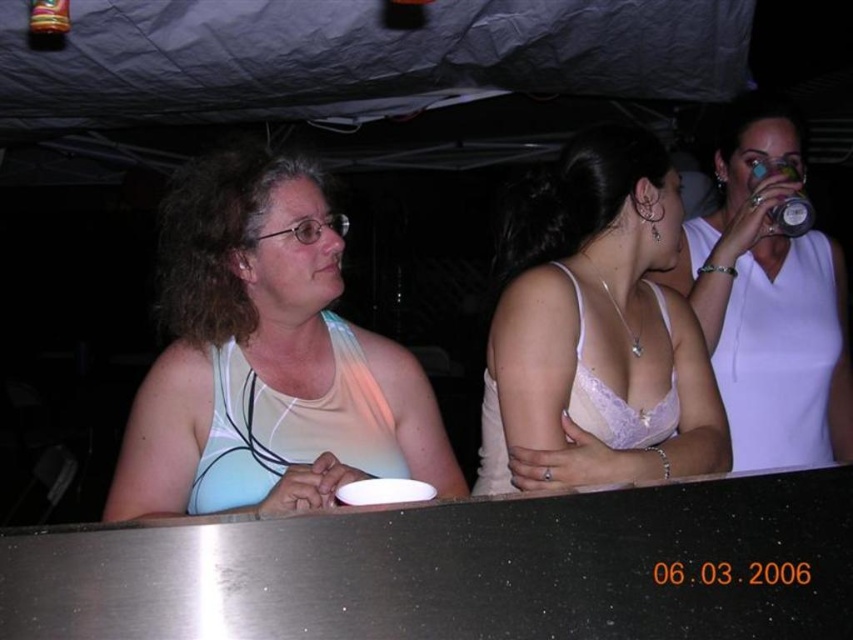
Question: Which object appears farthest from the camera in this image?

Choices:
 (A) white matte tank top at left
 (B) white lace bra at center
 (C) lacy white bikini top at center

Answer: (C)

Question: Can you confirm if white matte bikini top at left is positioned above lacy white bikini top at center?

Choices:
 (A) yes
 (B) no

Answer: (B)

Question: Which of the following is the closest to the observer?

Choices:
 (A) white matte bikini top at left
 (B) white matte tank top at left

Answer: (B)

Question: Is white matte tank top at upper right wider than metallic silver can at upper right?

Choices:
 (A) yes
 (B) no

Answer: (A)

Question: Which is farther from the metallic silver can at upper right?

Choices:
 (A) lacy white bikini top at center
 (B) white matte bikini top at left
 (C) white lace bra at center
 (D) white matte tank top at left

Answer: (B)

Question: Does white matte tank top at upper right appear on the right side of lacy white bikini top at center?

Choices:
 (A) no
 (B) yes

Answer: (B)